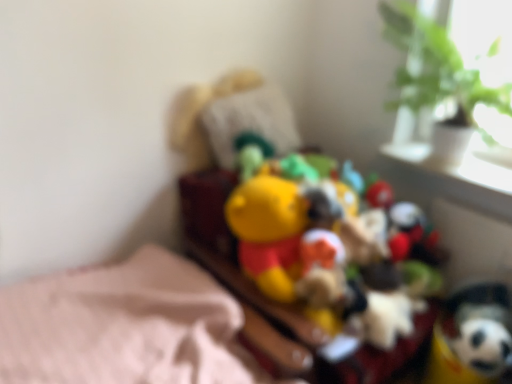
Question: Is yellow plush toy at center, which ranks as the 1th toy in left-to-right order, wider or thinner than soft plush toy at lower right, placed as the first toy when sorted from right to left?

Choices:
 (A) thin
 (B) wide

Answer: (B)

Question: Considering the positions of point (317, 264) and point (480, 322), is point (317, 264) closer or farther from the camera than point (480, 322)?

Choices:
 (A) closer
 (B) farther

Answer: (B)

Question: Based on their relative distances, which object is nearer to the white glossy window sill at upper right?

Choices:
 (A) yellow plush toy at center, arranged as the 2th toy when viewed from the right
 (B) soft plush toy at lower right, the second toy when ordered from left to right
 (C) green leafy plant at upper right

Answer: (C)

Question: Estimate the real-world distances between objects in this image. Which object is farther from the soft plush toy at lower right, the second toy when ordered from left to right?

Choices:
 (A) white glossy window sill at upper right
 (B) yellow plush toy at center, arranged as the 2th toy when viewed from the right
 (C) green leafy plant at upper right

Answer: (C)